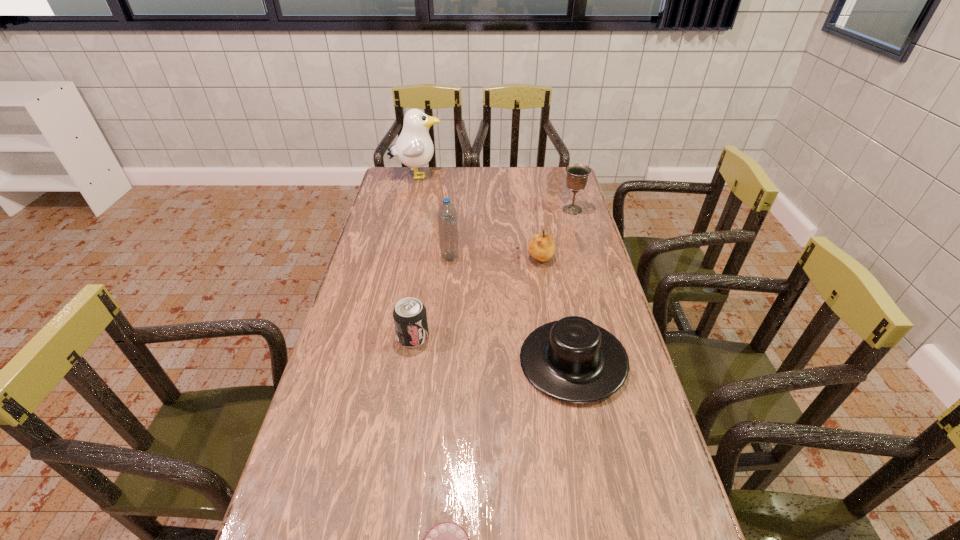
Identify the location of free location that satisfies the following two spatial constraints: 1. on the back side of the pear; 2. on the beak of the tallest object. click(x=522, y=176).

The image size is (960, 540). I want to click on vacant space that satisfies the following two spatial constraints: 1. on the beak of the dress hat; 2. on the right side of the gull, so click(375, 360).

Where is `free space that satisfies the following two spatial constraints: 1. on the beak of the dress hat; 2. on the right side of the gull`? free space that satisfies the following two spatial constraints: 1. on the beak of the dress hat; 2. on the right side of the gull is located at coordinates (375, 360).